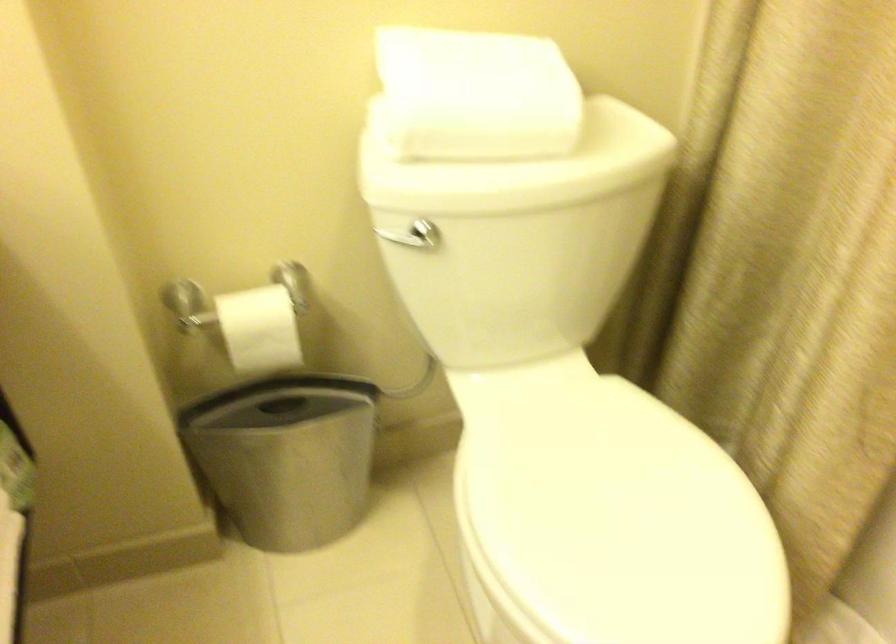
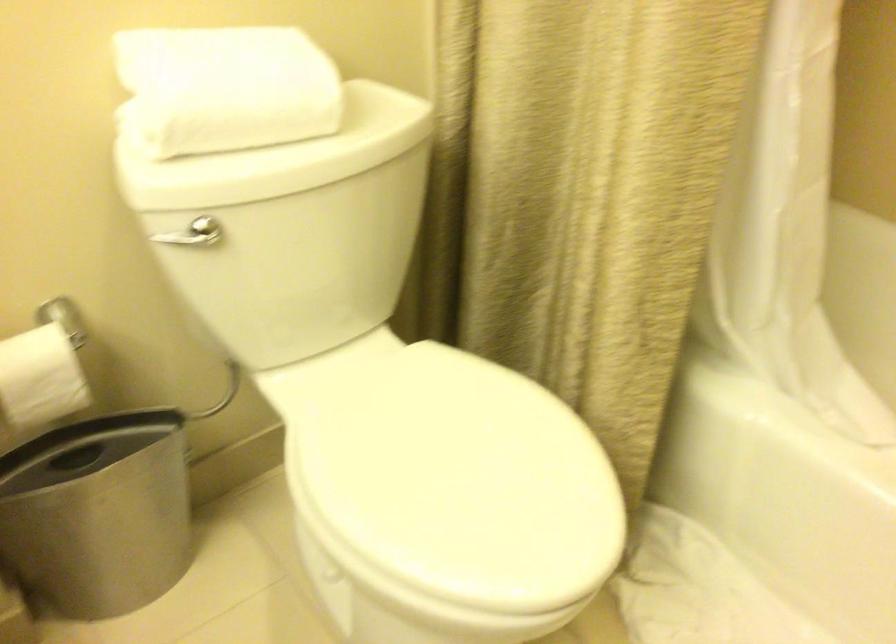
In the second image, find the point that corresponds to point 260,335 in the first image.

(39, 377)